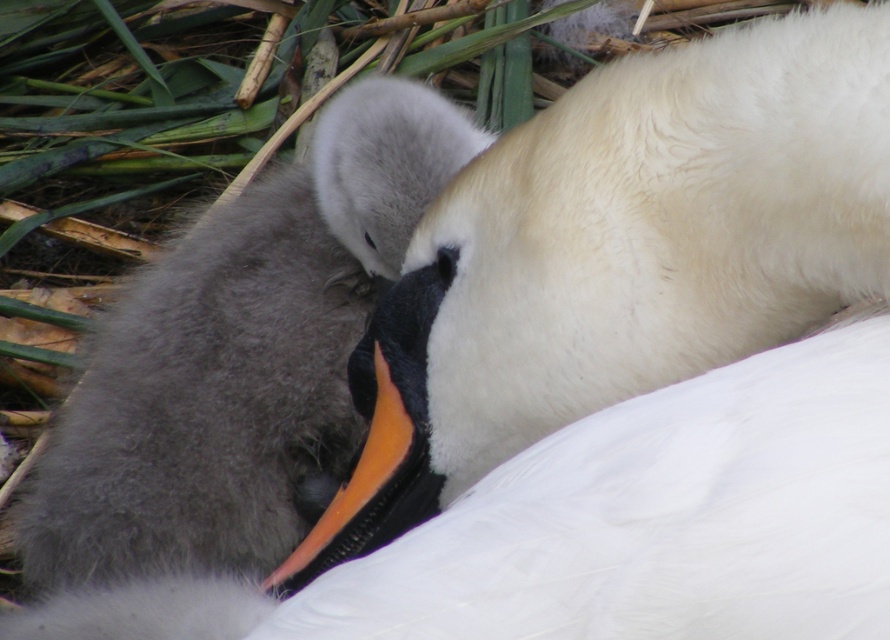
Does soft gray down at left come behind orange glossy beak at center?

Yes, it is behind orange glossy beak at center.

Describe the element at coordinates (241, 356) in the screenshot. I see `soft gray down at left` at that location.

Locate an element on the screen. The width and height of the screenshot is (890, 640). soft gray down at left is located at coordinates (241, 356).

The image size is (890, 640). What do you see at coordinates (637, 364) in the screenshot?
I see `white soft swan at center` at bounding box center [637, 364].

Does white soft swan at center have a lesser width compared to orange glossy beak at center?

No.

Who is more forward, (500,589) or (409,428)?

Point (500,589) is in front.

The width and height of the screenshot is (890, 640). I want to click on white soft swan at center, so click(637, 364).

Can you confirm if white soft swan at center is positioned to the right of soft gray down at left?

Yes, white soft swan at center is to the right of soft gray down at left.

Between point (737, 291) and point (71, 474), which one is positioned behind?

Positioned behind is point (71, 474).

The height and width of the screenshot is (640, 890). Find the location of `white soft swan at center`. white soft swan at center is located at coordinates (637, 364).